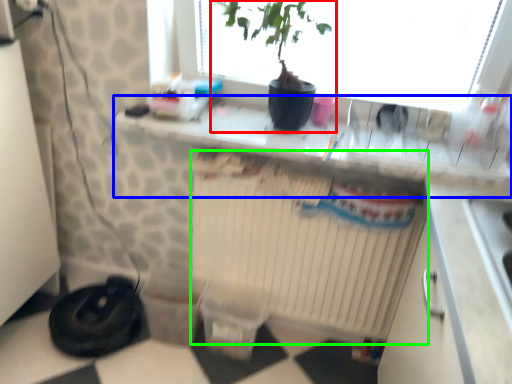
Question: Which object is positioned closest to houseplant (highlighted by a red box)? Select from counter top (highlighted by a blue box) and radiator (highlighted by a green box).

Choices:
 (A) counter top
 (B) radiator

Answer: (A)